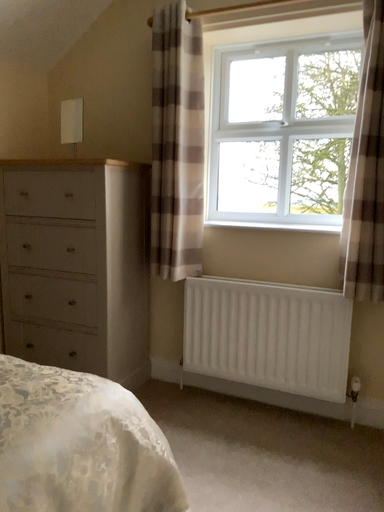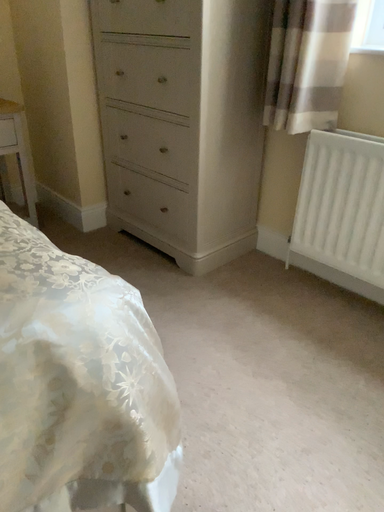
Question: Which way did the camera rotate in the video?

Choices:
 (A) rotated right
 (B) rotated left

Answer: (B)